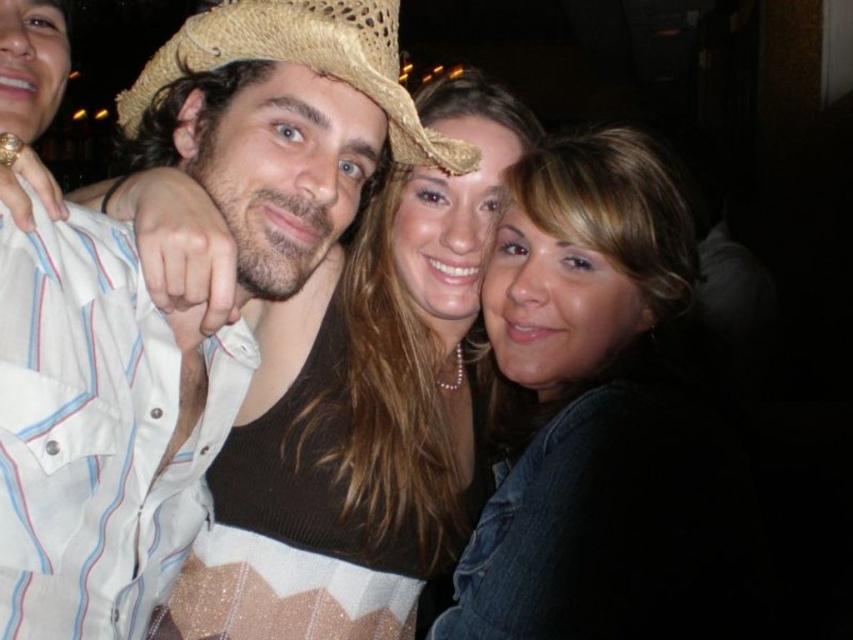
Question: Can you confirm if brown sweater at center is positioned to the left of strawhat at center?

Choices:
 (A) no
 (B) yes

Answer: (A)

Question: Based on their relative distances, which object is nearer to the smooth brown hair at center?

Choices:
 (A) matte straw hat at center
 (B) strawhat at center

Answer: (B)

Question: Which point is farther to the camera?

Choices:
 (A) (624, 580)
 (B) (207, 54)

Answer: (B)

Question: Can you confirm if brown sweater at center is smaller than strawhat at center?

Choices:
 (A) no
 (B) yes

Answer: (A)

Question: Does matte straw hat at center have a smaller size compared to smooth brown hair at center?

Choices:
 (A) yes
 (B) no

Answer: (A)

Question: Which point appears farthest from the camera in this image?

Choices:
 (A) (575, 488)
 (B) (97, 589)
 (C) (383, 74)
 (D) (444, 125)

Answer: (D)